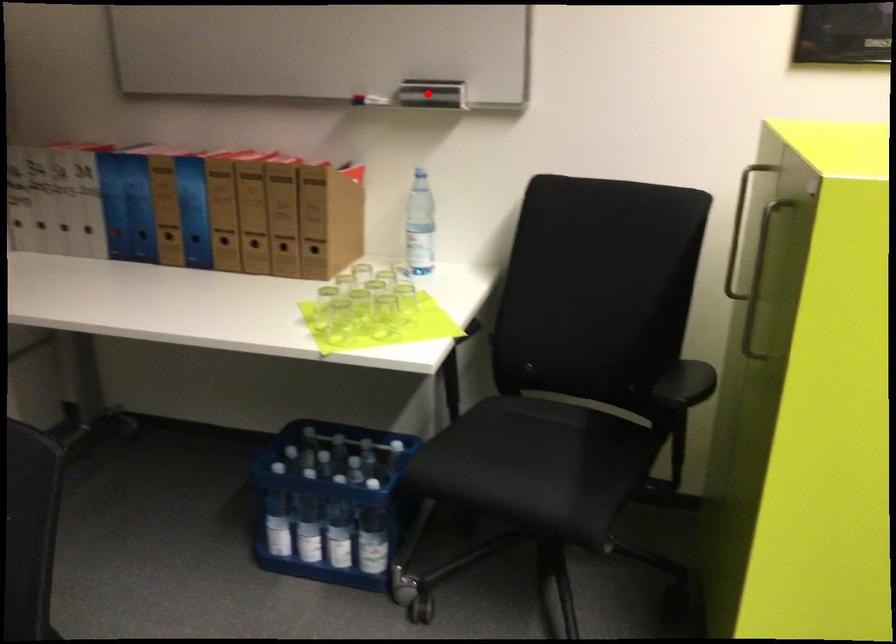
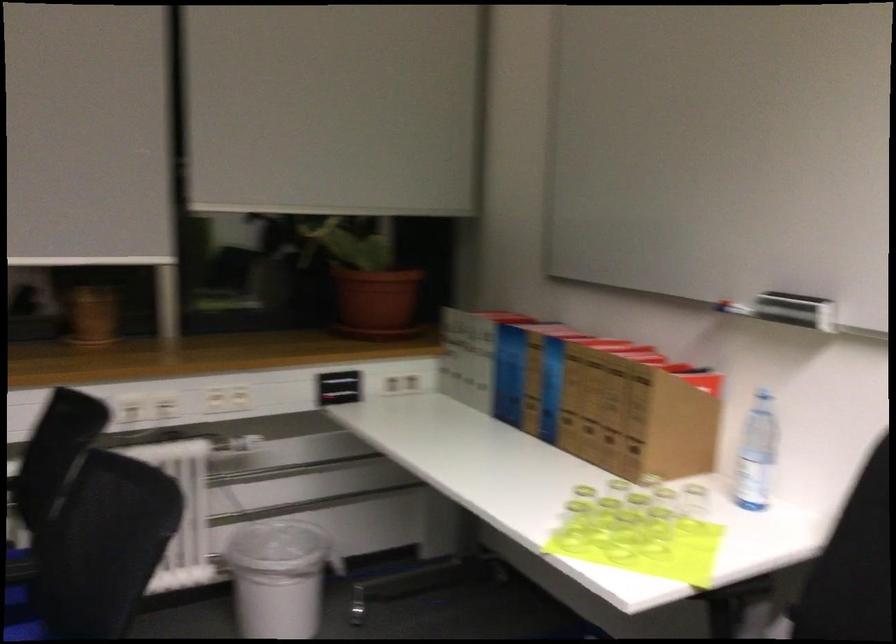
Locate, in the second image, the point that corresponds to the highlighted location in the first image.

(795, 310)